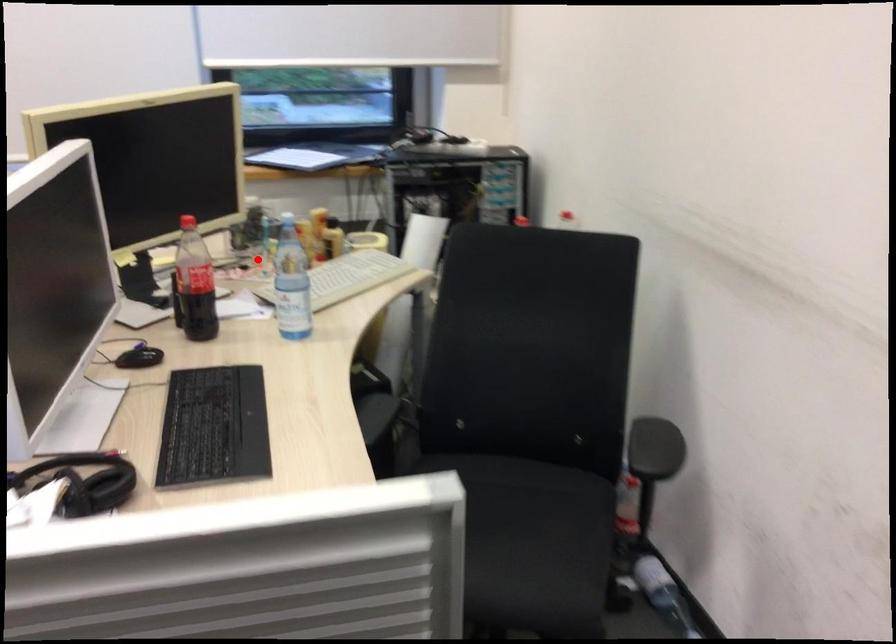
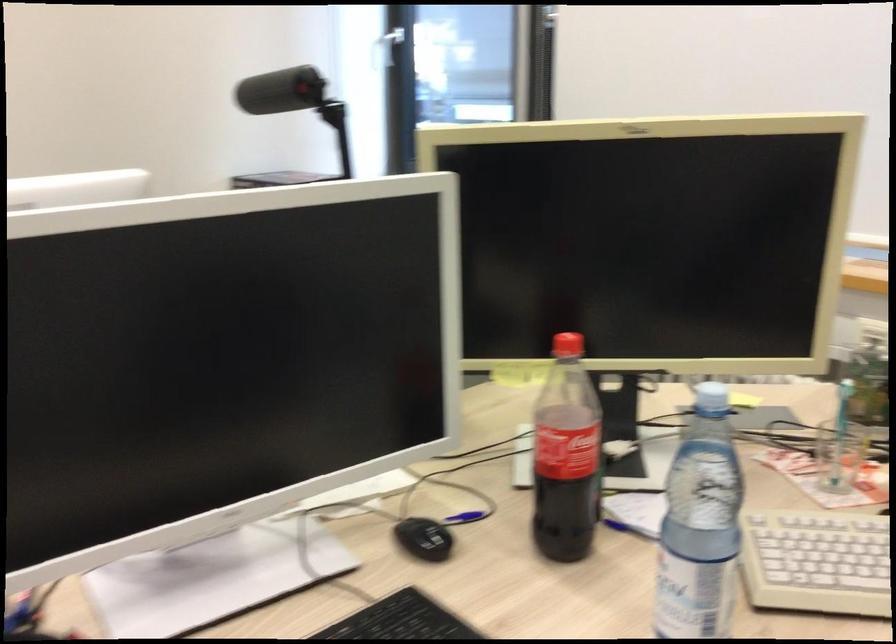
Locate, in the second image, the point that corresponds to the highlighted location in the first image.

(839, 456)